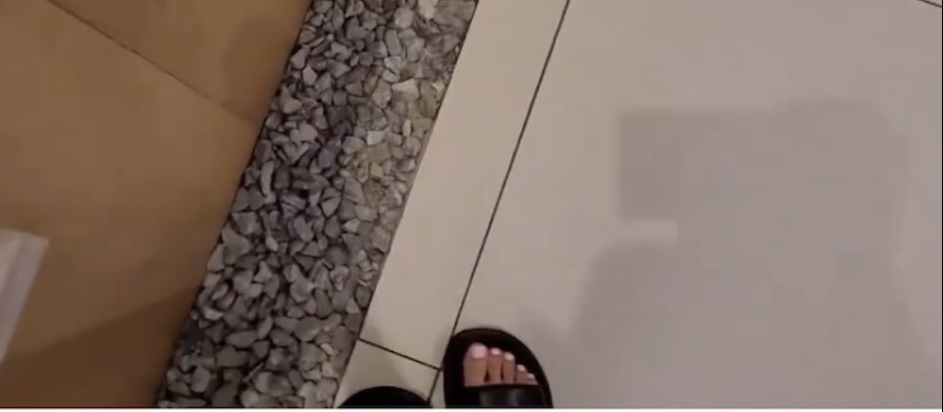
Identify the location of rock flooring. This screenshot has height=412, width=943. (286, 224).